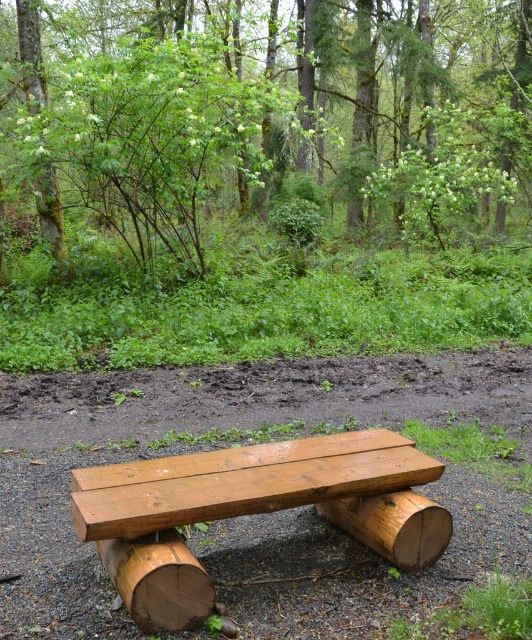
You are a hiker who wants to sit on the natural wood bench at center. There is a green leafy tree at upper center blocking your path. Can you walk around it to reach the bench?

The green leafy tree at upper center is further to the viewer than the natural wood bench at center, so the tree is closer to you. This means the bench is behind the tree, making it impossible to walk around the tree to reach the bench.

You are a hiker who wants to sit on the natural wood bench at center. Which direction should you look to avoid sitting directly under the green mossy tree trunk at upper left?

The natural wood bench at center is positioned under the green mossy tree trunk at upper left, so to avoid sitting directly under it, you should look away from the upper left direction.